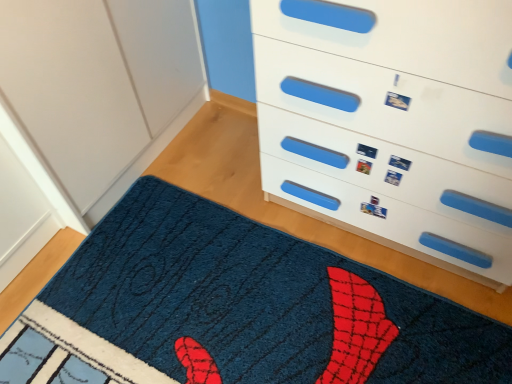
Question: In the image, is blue shaggy mat at lower center positioned in front of or behind white plastic chest of drawers at upper right?

Choices:
 (A) behind
 (B) front

Answer: (A)

Question: Is blue shaggy mat at lower center situated inside white plastic chest of drawers at upper right or outside?

Choices:
 (A) inside
 (B) outside

Answer: (B)

Question: Is blue shaggy mat at lower center to the left or to the right of white plastic chest of drawers at upper right in the image?

Choices:
 (A) right
 (B) left

Answer: (B)

Question: Is white plastic chest of drawers at upper right situated inside blue shaggy mat at lower center or outside?

Choices:
 (A) inside
 (B) outside

Answer: (B)

Question: From the image's perspective, relative to blue shaggy mat at lower center, is white plastic chest of drawers at upper right above or below?

Choices:
 (A) below
 (B) above

Answer: (B)

Question: Considering the positions of white plastic chest of drawers at upper right and blue shaggy mat at lower center in the image, is white plastic chest of drawers at upper right wider or thinner than blue shaggy mat at lower center?

Choices:
 (A) wide
 (B) thin

Answer: (B)

Question: Is white plastic chest of drawers at upper right in front of or behind blue shaggy mat at lower center in the image?

Choices:
 (A) front
 (B) behind

Answer: (A)